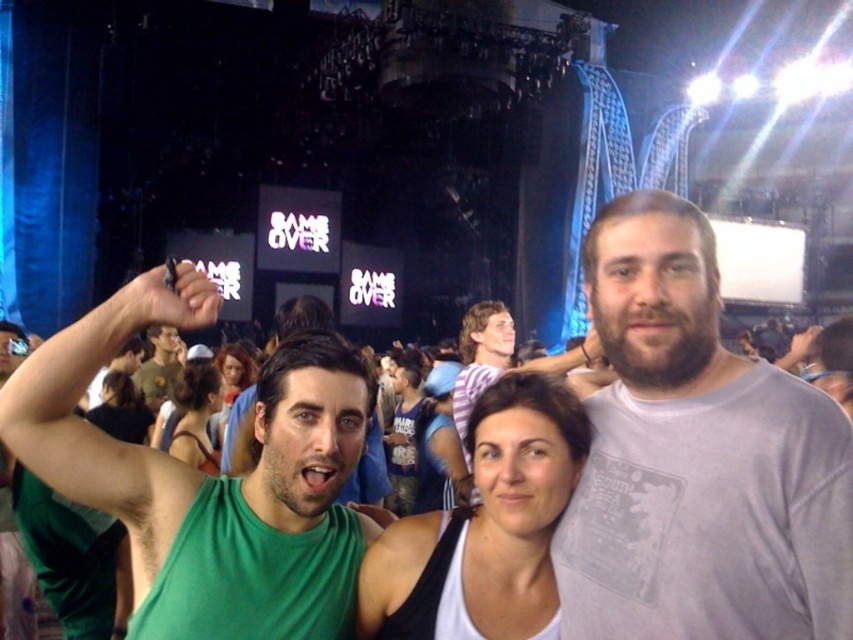
Between point (651, 528) and point (178, 397), which one is positioned behind?

The point (178, 397) is behind.

Describe the element at coordinates (697, 458) in the screenshot. The height and width of the screenshot is (640, 853). I see `gray cotton t-shirt at center` at that location.

Where is `gray cotton t-shirt at center`? Image resolution: width=853 pixels, height=640 pixels. gray cotton t-shirt at center is located at coordinates (697, 458).

From the picture: Can you confirm if matte blue tank top at center is thinner than smooth brown hair at center?

Indeed, matte blue tank top at center has a lesser width compared to smooth brown hair at center.

What do you see at coordinates (403, 438) in the screenshot?
I see `matte blue tank top at center` at bounding box center [403, 438].

The image size is (853, 640). I want to click on matte blue tank top at center, so click(x=403, y=438).

The width and height of the screenshot is (853, 640). What do you see at coordinates (196, 413) in the screenshot?
I see `dark brown hair at center` at bounding box center [196, 413].

Between point (183, 429) and point (218, 353), which one is positioned in front?

Point (183, 429) is in front.

Is point (196, 369) behind point (231, 355)?

No, (196, 369) is closer to viewer.

Where is `dark brown hair at center`? dark brown hair at center is located at coordinates (196, 413).